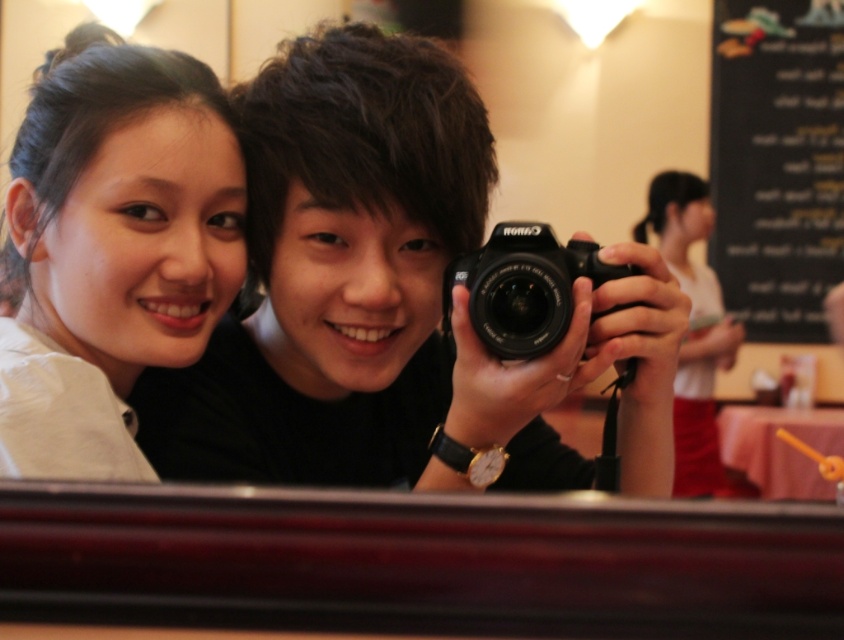
You are a photographer trying to capture a clear shot of the matte white shirt at left and the black chalkboard menu at upper right. Based on their positions, which object should you focus on first to ensure both are in sharp focus?

The matte white shirt at left is below the black chalkboard menu at upper right, so you should focus on the matte white shirt at left first to ensure both are in sharp focus since it is closer to the camera.

You are a photographer trying to capture a group photo of two people. You see the matte white shirt at left and the white matte shirt at upper right in the scene. Which shirt is positioned more to the left side of the image?

The matte white shirt at left is positioned more to the left side of the image compared to the white matte shirt at upper right.

You are a photographer adjusting the focus of your Canon DSLR camera. You want to ensure that the matte white shirt at left is in sharp focus. Based on their position, will the shirt be in focus if you focus on the person holding the camera?

The matte white shirt at left is located at point [111,248], which is not the same as the position of the person holding the camera. Therefore, focusing on the person holding the camera may not ensure the matte white shirt at left is in focus.